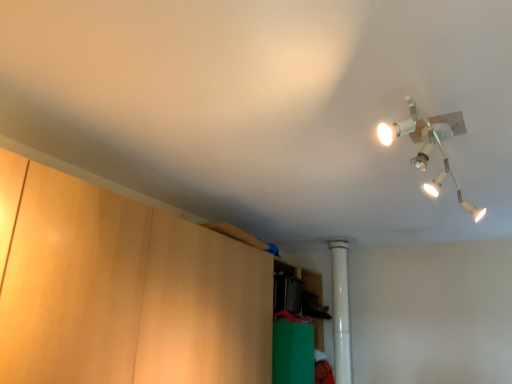
Question: From the image's perspective, would you say white metallic lamp at upper right is shown under wooden cabinet at left, which ranks as the 2th cabinetry in back-to-front order?

Choices:
 (A) no
 (B) yes

Answer: (A)

Question: Is white metallic lamp at upper right looking in the opposite direction of wooden cabinet at left, the 1th cabinetry viewed from the front?

Choices:
 (A) no
 (B) yes

Answer: (A)

Question: Is white metallic lamp at upper right not within wooden cabinet at left, the 1th cabinetry viewed from the front?

Choices:
 (A) no
 (B) yes

Answer: (B)

Question: Is white metallic lamp at upper right facing towards wooden cabinet at left, which ranks as the 2th cabinetry in back-to-front order?

Choices:
 (A) yes
 (B) no

Answer: (B)

Question: Considering the relative sizes of white metallic lamp at upper right and wooden cabinet at left, the 1th cabinetry viewed from the front, in the image provided, is white metallic lamp at upper right thinner than wooden cabinet at left, the 1th cabinetry viewed from the front,?

Choices:
 (A) yes
 (B) no

Answer: (B)

Question: Is point (74, 284) closer or farther from the camera than point (342, 382)?

Choices:
 (A) farther
 (B) closer

Answer: (B)

Question: From a real-world perspective, is wooden cabinet at left, which ranks as the 2th cabinetry in back-to-front order, physically located above or below white plastic pipe at center?

Choices:
 (A) above
 (B) below

Answer: (B)

Question: From the image's perspective, is wooden cabinet at left, which ranks as the 2th cabinetry in back-to-front order, positioned above or below white plastic pipe at center?

Choices:
 (A) above
 (B) below

Answer: (A)

Question: From their relative heights in the image, would you say wooden cabinet at left, the 1th cabinetry viewed from the front, is taller or shorter than white plastic pipe at center?

Choices:
 (A) short
 (B) tall

Answer: (A)

Question: Do you think white plastic pipe at center is within wooden cabinet at left, which ranks as the 2th cabinetry in back-to-front order, or outside of it?

Choices:
 (A) outside
 (B) inside

Answer: (A)

Question: In terms of size, does white plastic pipe at center appear bigger or smaller than wooden cabinet at left, the 1th cabinetry viewed from the front?

Choices:
 (A) big
 (B) small

Answer: (B)

Question: From the image's perspective, is white plastic pipe at center positioned above or below wooden cabinet at left, which ranks as the 2th cabinetry in back-to-front order?

Choices:
 (A) above
 (B) below

Answer: (B)

Question: Is white plastic pipe at center wider or thinner than wooden cabinet at left, the 1th cabinetry viewed from the front?

Choices:
 (A) thin
 (B) wide

Answer: (A)

Question: Does point (332, 316) appear closer or farther from the camera than point (426, 152)?

Choices:
 (A) farther
 (B) closer

Answer: (A)

Question: Looking at the image, does white plastic pipe at center seem bigger or smaller compared to white metallic lamp at upper right?

Choices:
 (A) big
 (B) small

Answer: (B)